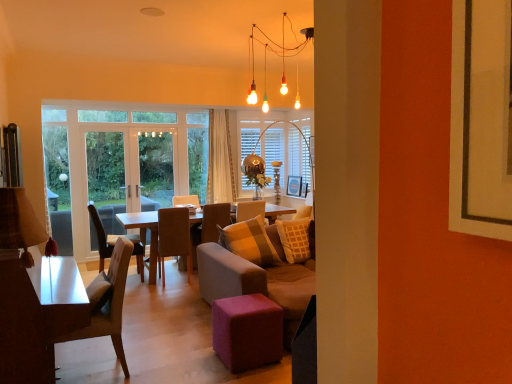
Question: Relative to wooden coffee table at center, is velvet brown chair at center, which is the first chair from back to front, in front or behind?

Choices:
 (A) front
 (B) behind

Answer: (B)

Question: Is velvet brown chair at center, which is the first chair from back to front, bigger or smaller than wooden coffee table at center?

Choices:
 (A) big
 (B) small

Answer: (B)

Question: Which of these objects is positioned closest to the brown fabric chair at center, which ranks as the 2th chair in back-to-front order?

Choices:
 (A) brown fabric chair at center, arranged as the 3th chair when viewed from the back
 (B) wooden picture frame at center, which is the 2th picture frame from front to back
 (C) purple fabric stool at center
 (D) clear glass door at center, positioned as the 2th screen door in left-to-right order
 (E) velvet beige couch at center

Answer: (D)

Question: Estimate the real-world distances between objects in this image. Which object is farther from the clear glass door at center, marked as the 1th screen door in a right-to-left arrangement?

Choices:
 (A) wooden picture frame at center, which is counted as the 1th picture frame, starting from the front
 (B) purple fabric stool at center
 (C) transparent glass door at left, placed as the 1th screen door when sorted from left to right
 (D) white sheer curtain at center
 (E) wooden picture frame at center, the first picture frame from the back

Answer: (B)